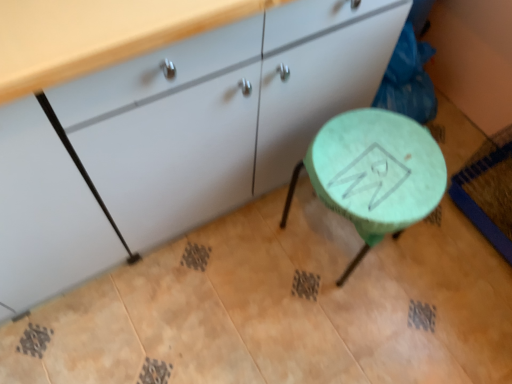
Identify the location of vacant space situated above green matte stool at center (from a real-world perspective). This screenshot has width=512, height=384. (378, 162).